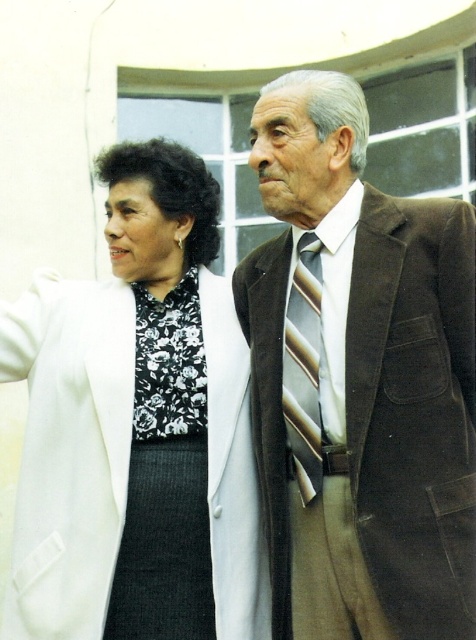
You are a photographer setting up for a group photo. You need to ensure that the suede brown suit at right and the striped silk tie at center are both visible in the frame. Based on their positions and sizes, which object might require you to adjust your camera angle to accommodate its width?

The suede brown suit at right might be wider than the striped silk tie at center, so adjusting the camera angle to account for its width would ensure both are fully visible.

You are a photographer trying to focus on both the white textured coat at center and the striped silk tie at center in the image. Since the camera can only focus on one object at a time, which object should you choose to ensure the larger one is in focus?

The white textured coat at center is larger in size than the striped silk tie at center, so you should focus on the white textured coat at center to ensure the larger object is in focus.

You are a photographer trying to capture the perfect shot of the white textured coat at center. Based on its coordinates, where should you position your camera to ensure it is centered in the frame?

The white textured coat at center is located at coordinates point (138, 428), so positioning the camera to align the center of the frame with these coordinates will ensure the coat is centered in the shot.